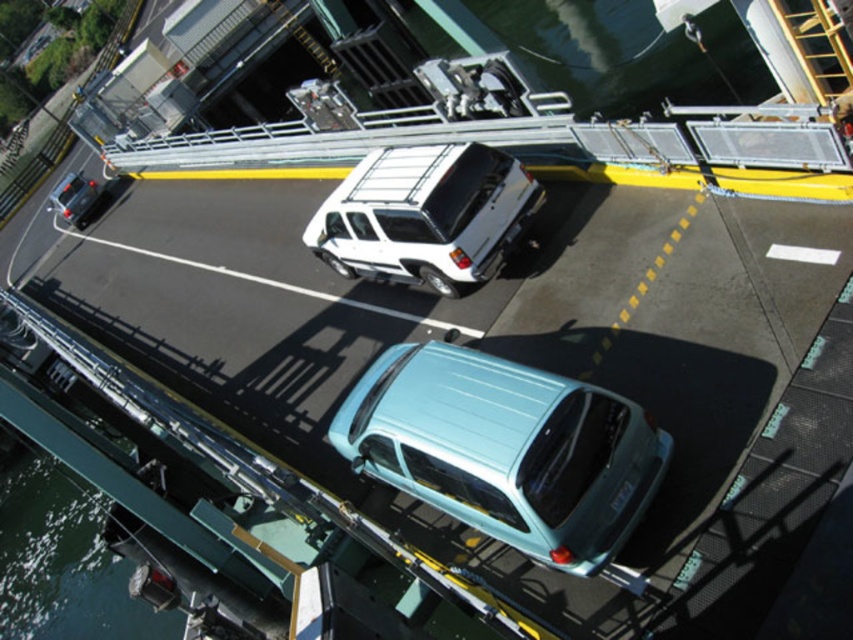
Between point (467, 467) and point (451, 237), which one is positioned behind?

The point (451, 237) is more distant.

Who is more forward, (x=625, y=406) or (x=514, y=208)?

Point (x=625, y=406) is in front.

Is point (428, 369) positioned in front of point (490, 220)?

Yes.

Find the location of a particular element. The width and height of the screenshot is (853, 640). light blue matte hatchback at center is located at coordinates [505, 449].

Who is lower down, light blue matte hatchback at center or matte black car at left?

light blue matte hatchback at center is below.

Who is higher up, light blue matte hatchback at center or matte black car at left?

Positioned higher is matte black car at left.

Where is `light blue matte hatchback at center`? light blue matte hatchback at center is located at coordinates [x=505, y=449].

Where is `light blue matte hatchback at center`? Image resolution: width=853 pixels, height=640 pixels. light blue matte hatchback at center is located at coordinates (505, 449).

Between white matte truck at center and matte black car at left, which one appears on the right side from the viewer's perspective?

From the viewer's perspective, white matte truck at center appears more on the right side.

What do you see at coordinates (425, 216) in the screenshot?
I see `white matte truck at center` at bounding box center [425, 216].

Where is `white matte truck at center`? white matte truck at center is located at coordinates (425, 216).